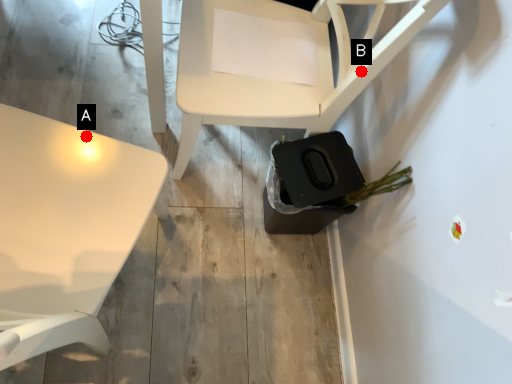
Question: Two points are circled on the image, labeled by A and B beside each circle. Among these points, which one is nearest to the camera?

Choices:
 (A) A is closer
 (B) B is closer

Answer: (A)